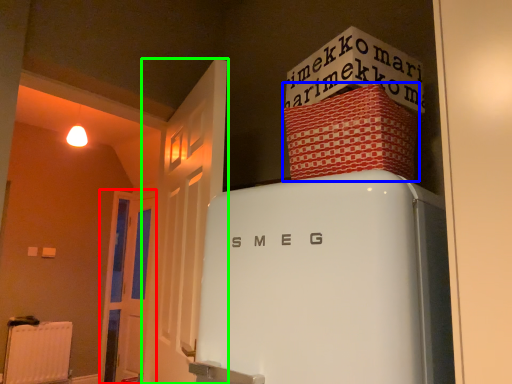
Question: Considering the real-world distances, which object is farthest from door (highlighted by a red box)? cardboard box (highlighted by a blue box) or door (highlighted by a green box)?

Choices:
 (A) cardboard box
 (B) door

Answer: (A)